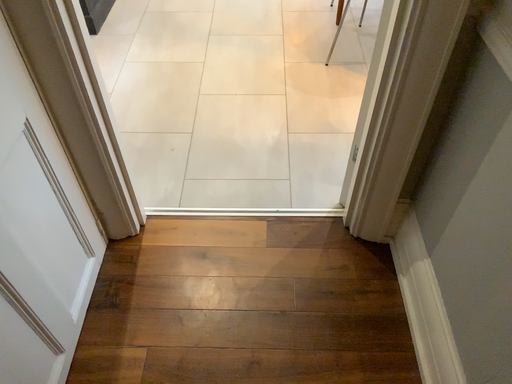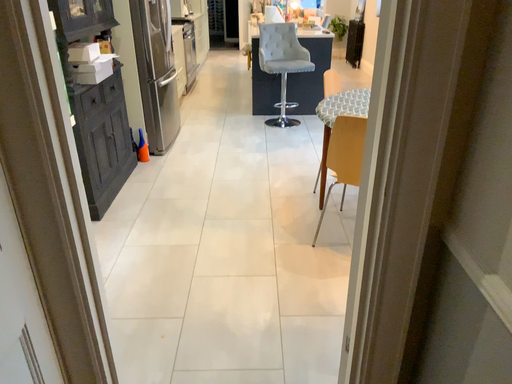
Question: How did the camera likely rotate when shooting the video?

Choices:
 (A) rotated upward
 (B) rotated downward

Answer: (A)